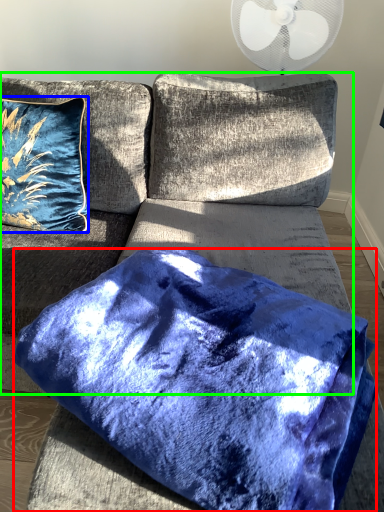
Question: Considering the real-world distances, which object is closest to pillow (highlighted by a red box)? pillow (highlighted by a blue box) or couch (highlighted by a green box).

Choices:
 (A) pillow
 (B) couch

Answer: (B)